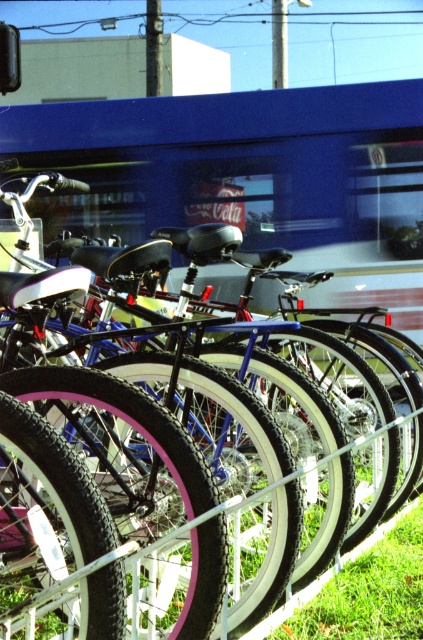
You are a delivery person who needs to choose a vehicle to deliver packages in the city. You see a blue reflective train at center and a pink rubber bicycle at center. Which one is more suitable for carrying heavy packages?

The blue reflective train at center is bigger than the pink rubber bicycle at center, so it is more suitable for carrying heavy packages.

You are a delivery person who needs to move a package from the blue reflective train at center to the pink rubber bicycle at center. Since both are at the center, which direction should you move the package to reach the destination?

The blue reflective train at center is to the right of the pink rubber bicycle at center, so you should move the package to the left to reach the destination.

Based on the photo, you are a delivery person who needs to load a package onto a cart. The cart can only hold items that are below a certain height. You see the blue reflective train at center and the pink rubber bicycle at center in your path. Which object should you avoid placing on the cart to ensure it stays under the height limit?

The blue reflective train at center is above the pink rubber bicycle at center, so you should avoid placing the blue reflective train at center on the cart to stay under the height limit.